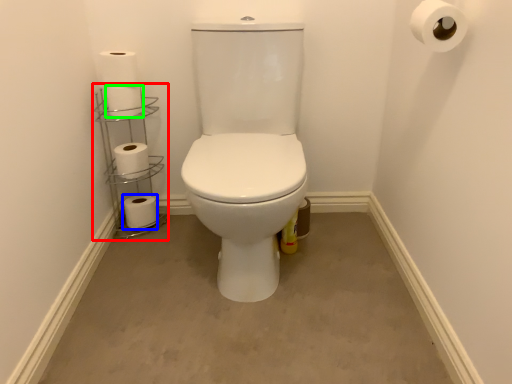
Question: Estimate the real-world distances between objects in this image. Which object is farther from shelf (highlighted by a red box), toilet paper (highlighted by a blue box) or toilet paper (highlighted by a green box)?

Choices:
 (A) toilet paper
 (B) toilet paper

Answer: (B)